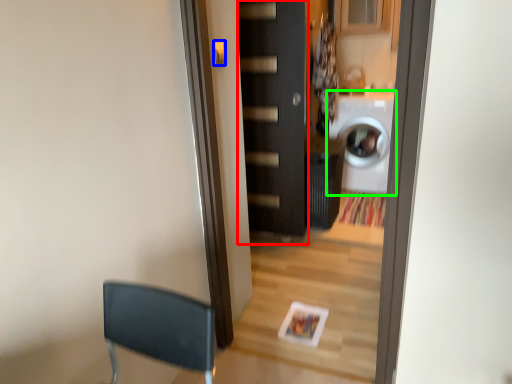
Question: Which is farther away from door (highlighted by a red box)? door handle (highlighted by a blue box) or washing machine (highlighted by a green box)?

Choices:
 (A) door handle
 (B) washing machine

Answer: (A)